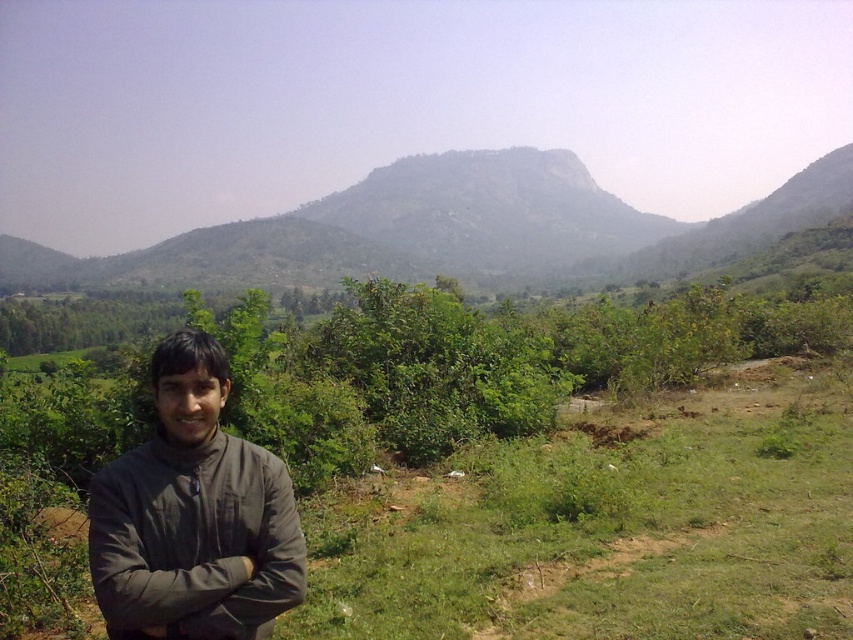
Who is lower down, green textured mountain at center or dark gray jacket at lower left?

dark gray jacket at lower left

Does green textured mountain at center appear on the right side of dark gray jacket at lower left?

No, green textured mountain at center is not to the right of dark gray jacket at lower left.

At what (x,y) coordinates should I click in order to perform the action: click on green textured mountain at center. Please return your answer as a coordinate pair (x, y). The width and height of the screenshot is (853, 640). Looking at the image, I should click on (451, 228).